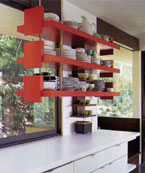
Where is `window`? The image size is (145, 173). window is located at coordinates [122, 89], [13, 105].